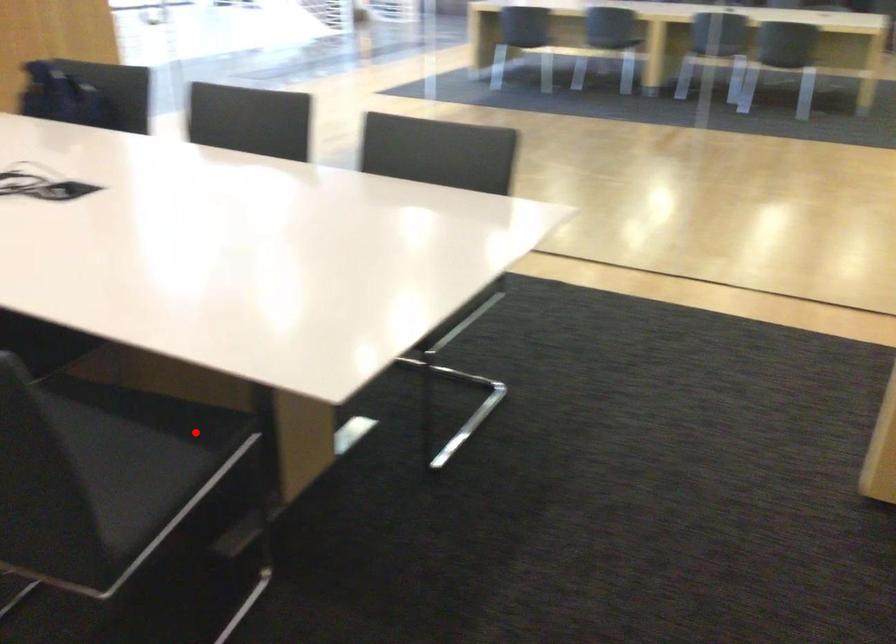
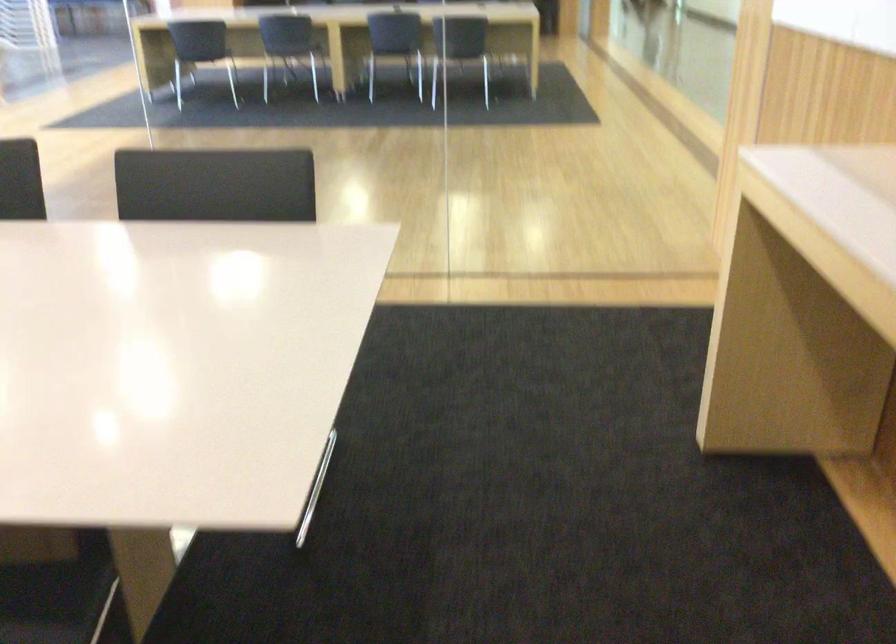
Question: I am providing you with two images of the same scene from different viewpoints. Image1 has a red point marked. In image2, the corresponding 3D location appears at what relative position? Reply with the corresponding letter.

Choices:
 (A) Closer
 (B) Farther

Answer: (A)